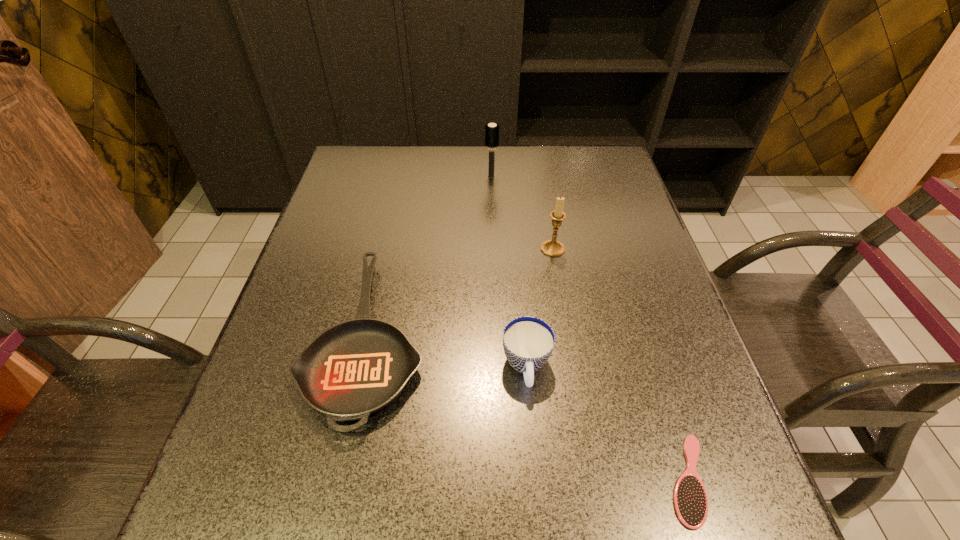
At what (x,y) coordinates should I click in order to perform the action: click on the farther hairbrush. Please return your answer as a coordinate pair (x, y). This screenshot has height=540, width=960. Looking at the image, I should click on (491, 130).

Where is `the taller hairbrush`? The height and width of the screenshot is (540, 960). the taller hairbrush is located at coordinates (491, 130).

In order to click on candle holder in this screenshot , I will do `click(552, 248)`.

Identify the location of the second object from right to left. (552, 248).

Locate an element on the screen. cup is located at coordinates (528, 342).

At what (x,y) coordinates should I click in order to perform the action: click on frying pan. Please return your answer as a coordinate pair (x, y). Looking at the image, I should click on [x=355, y=368].

The height and width of the screenshot is (540, 960). What are the coordinates of `the second shortest object` in the screenshot? It's located at (355, 368).

Locate an element on the screen. the nearer hairbrush is located at coordinates (690, 497).

Locate an element on the screen. the shorter hairbrush is located at coordinates (690, 497).

Locate an element on the screen. free location located on the front of the farther hairbrush is located at coordinates (492, 234).